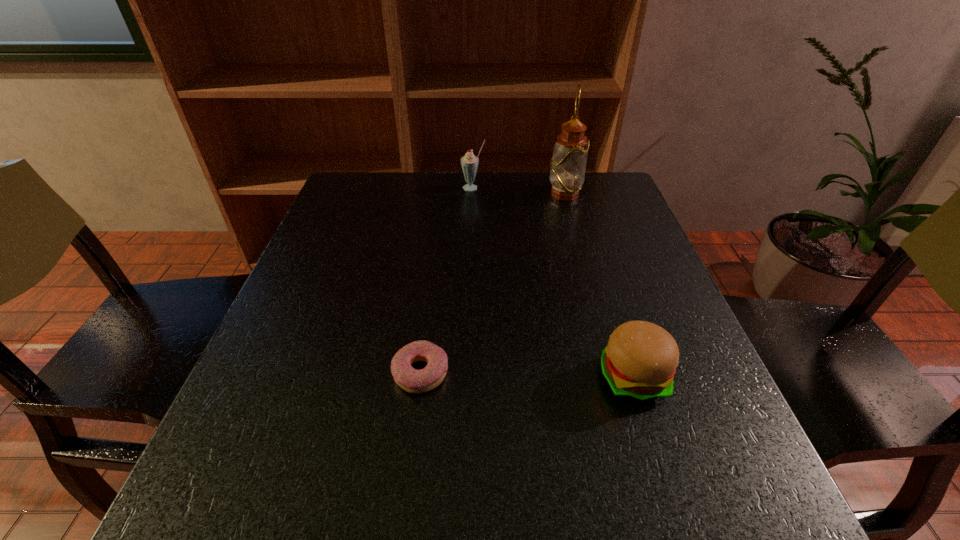
Where is `vacant area at the near right corner of the desktop`? The width and height of the screenshot is (960, 540). vacant area at the near right corner of the desktop is located at coordinates (756, 509).

Locate an element on the screen. The height and width of the screenshot is (540, 960). vacant area between the second object from left to right and the shortest object is located at coordinates (447, 280).

Identify the location of free space between the second shortest object and the oil lamp. The height and width of the screenshot is (540, 960). (598, 286).

Where is `empty space that is in between the second shortest object and the tallest object`? The image size is (960, 540). empty space that is in between the second shortest object and the tallest object is located at coordinates (598, 286).

Identify the location of free spot between the second shortest object and the second tallest object. (553, 282).

The image size is (960, 540). What are the coordinates of `empty space that is in between the milkshake and the doughnut` in the screenshot? It's located at coord(447,280).

I want to click on vacant area between the tallest object and the shortest object, so click(x=492, y=283).

The image size is (960, 540). In order to click on free spot between the milkshake and the oil lamp in this screenshot , I will do `click(518, 191)`.

Where is `free space between the oil lamp and the milkshake`? This screenshot has width=960, height=540. free space between the oil lamp and the milkshake is located at coordinates (518, 191).

Locate an element on the screen. The image size is (960, 540). free space between the tallest object and the milkshake is located at coordinates (518, 191).